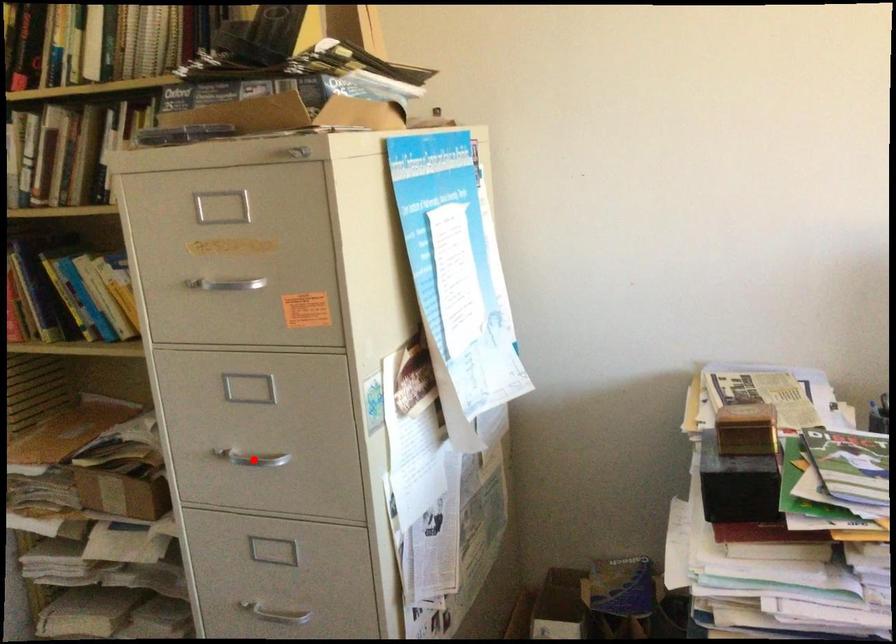
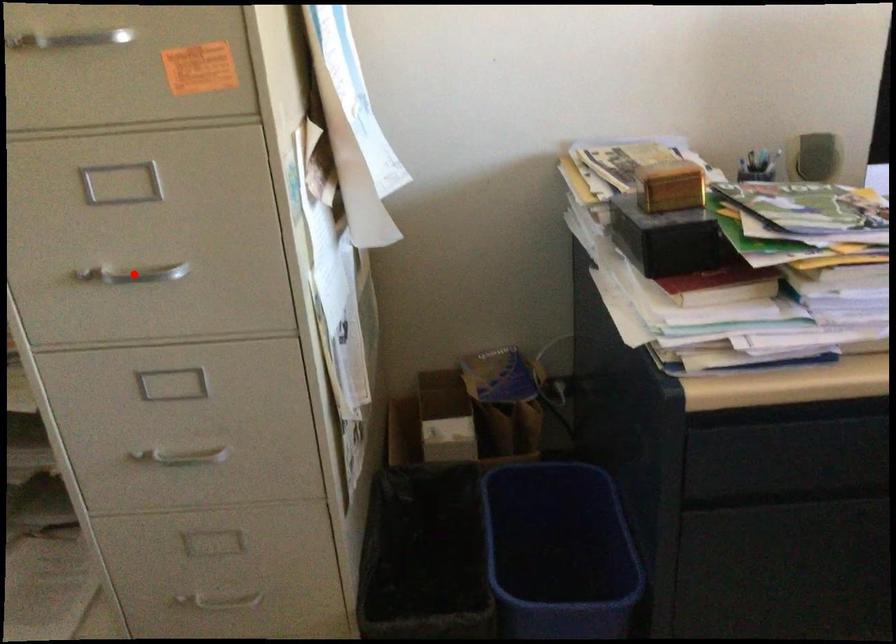
I am providing you with two images of the same scene from different viewpoints. A red point is marked on the first image and another point is marked on the second image. Is the red point in image1 aligned with the point shown in image2?

Yes